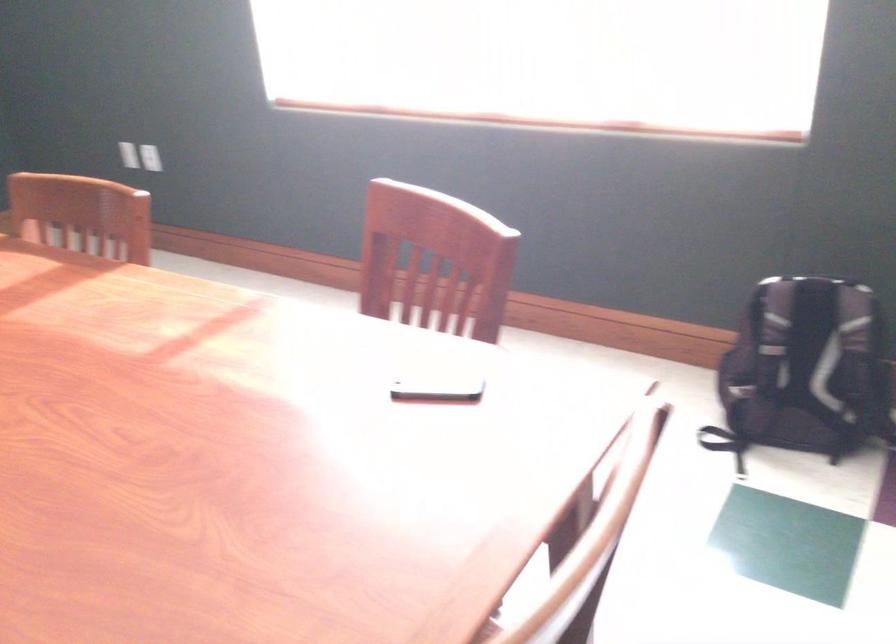
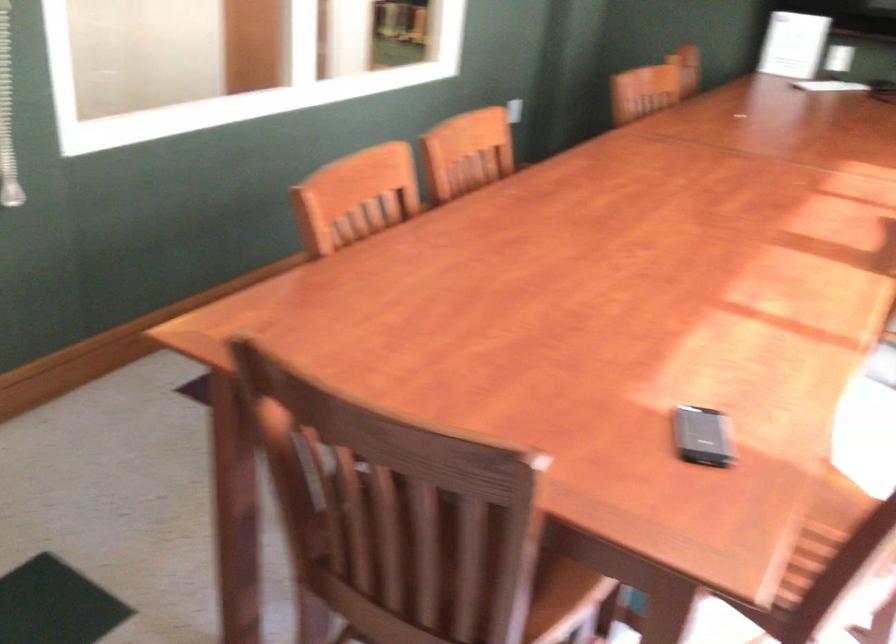
The images are taken continuously from a first-person perspective. In which direction is your viewpoint rotating?

The camera's rotation is toward left-down.